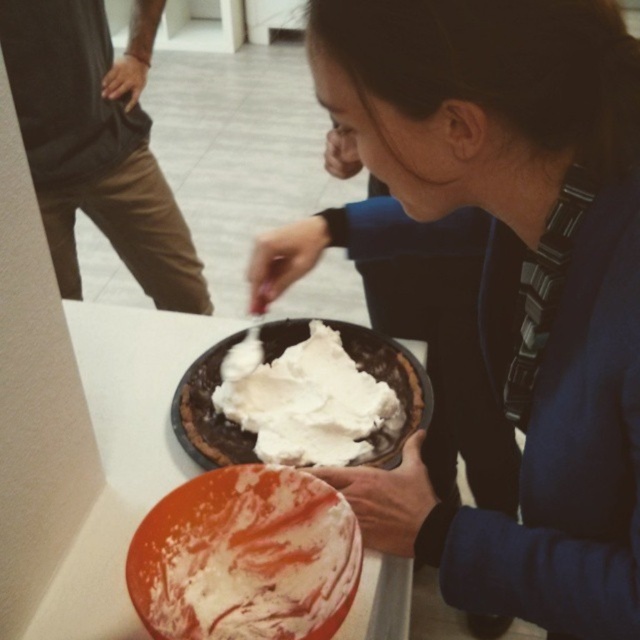
Which is behind, point (186, 282) or point (337, 339)?

Point (186, 282)

Who is positioned more to the right, brown cotton pants at left or white fluffy frosting at center?

Positioned to the right is white fluffy frosting at center.

What are the coordinates of `brown cotton pants at left` in the screenshot? It's located at (97, 144).

Does brown cotton pants at left have a larger size compared to white creamy cake at lower center?

Correct, brown cotton pants at left is larger in size than white creamy cake at lower center.

In the scene shown: Is brown cotton pants at left to the left of white creamy cake at lower center from the viewer's perspective?

Indeed, brown cotton pants at left is positioned on the left side of white creamy cake at lower center.

You are a GUI agent. You are given a task and a screenshot of the screen. Output one action in this format:
    pyautogui.click(x=<x>, y=<y>)
    Task: Click on the brown cotton pants at left
    The width and height of the screenshot is (640, 640).
    Given the screenshot: What is the action you would take?
    pyautogui.click(x=97, y=144)

Is white creamy cake at lower center thinner than white fluffy frosting at center?

Correct, white creamy cake at lower center's width is less than white fluffy frosting at center's.

Is white creamy cake at lower center above white fluffy frosting at center?

No, white creamy cake at lower center is not above white fluffy frosting at center.

Does point (248, 547) come farther from viewer compared to point (307, 406)?

No, it is in front of (307, 406).

The height and width of the screenshot is (640, 640). Identify the location of white creamy cake at lower center. (248, 557).